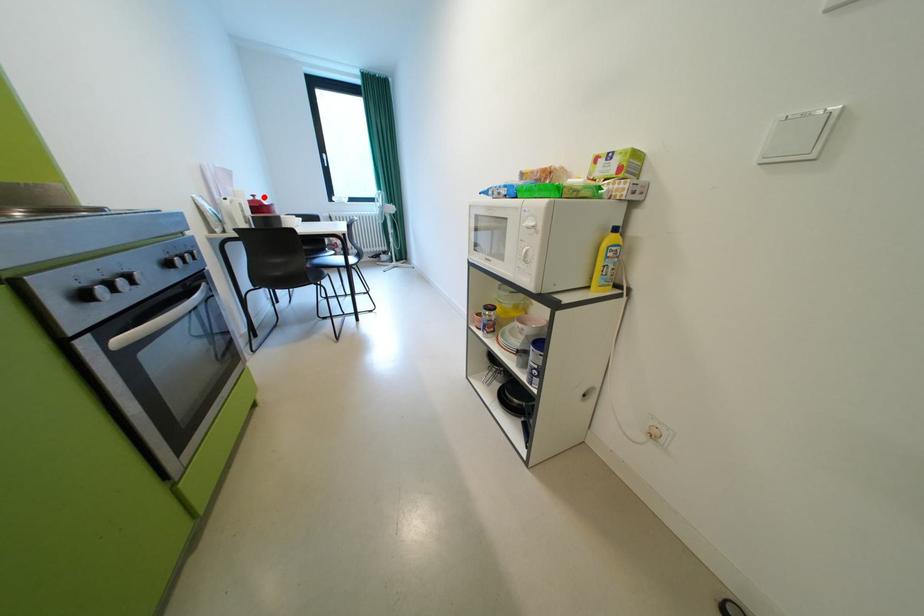
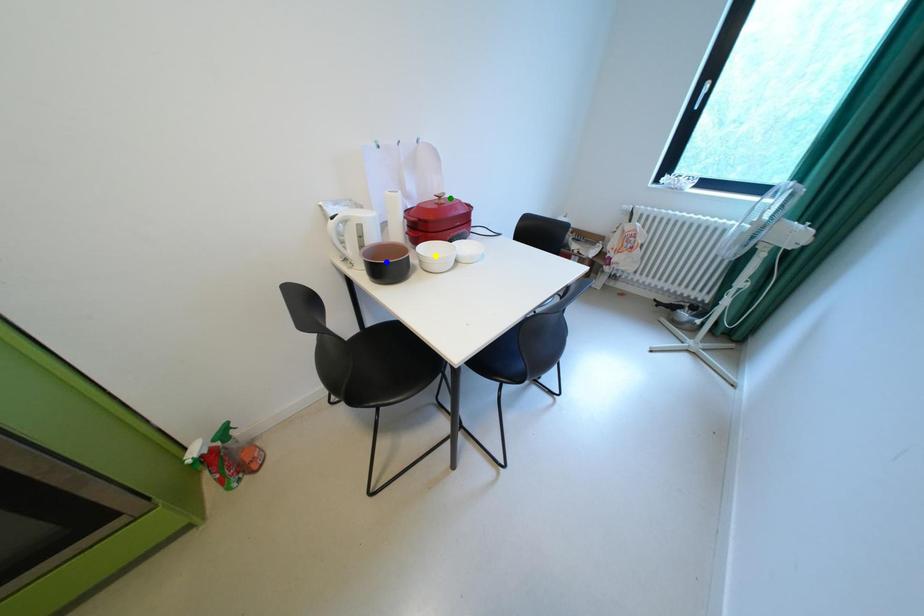
Question: I am providing you with two images of the same scene from different viewpoints. A red point is marked on the first image. You are given multiple points on the second image. Can you choose the point in image 2 that corresponds to the point in image 1?

Choices:
 (A) yellow point
 (B) green point
 (C) blue point

Answer: (B)